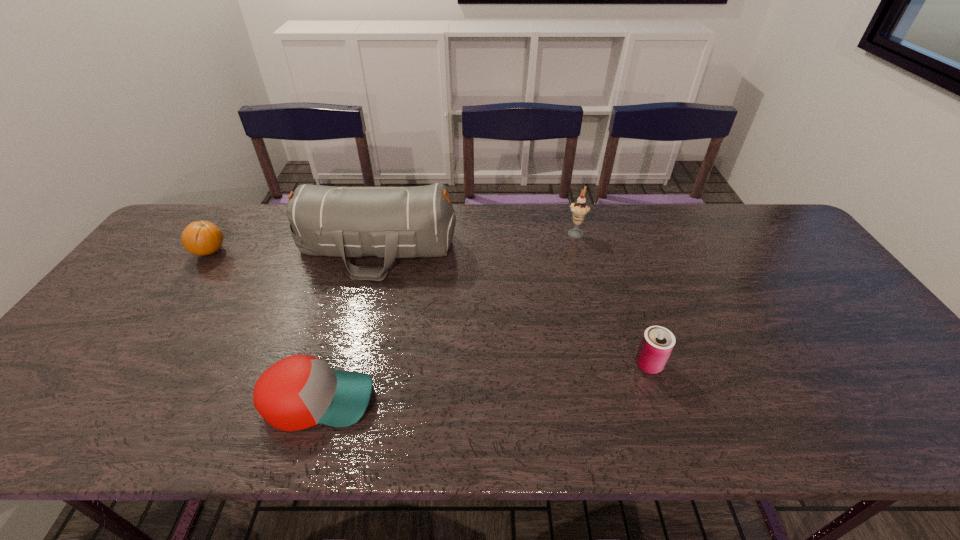
Locate an element on the screen. blank space located at the brim of the baseball cap is located at coordinates (428, 400).

This screenshot has width=960, height=540. What are the coordinates of `duffel bag located at the far edge` in the screenshot? It's located at (388, 222).

I want to click on icecream at the far edge, so [580, 208].

Identify the location of orange at the far edge. This screenshot has width=960, height=540. (202, 238).

Identify the location of object located at the near edge. pos(300,391).

The image size is (960, 540). I want to click on object located at the left edge, so click(202, 238).

Where is `object situated at the far left corner`? object situated at the far left corner is located at coordinates (202, 238).

The image size is (960, 540). In order to click on vacant space at the far edge in this screenshot , I will do `click(478, 204)`.

Where is `blank space at the near edge`? The height and width of the screenshot is (540, 960). blank space at the near edge is located at coordinates (516, 444).

The height and width of the screenshot is (540, 960). What are the coordinates of `free space at the left edge` in the screenshot? It's located at (137, 341).